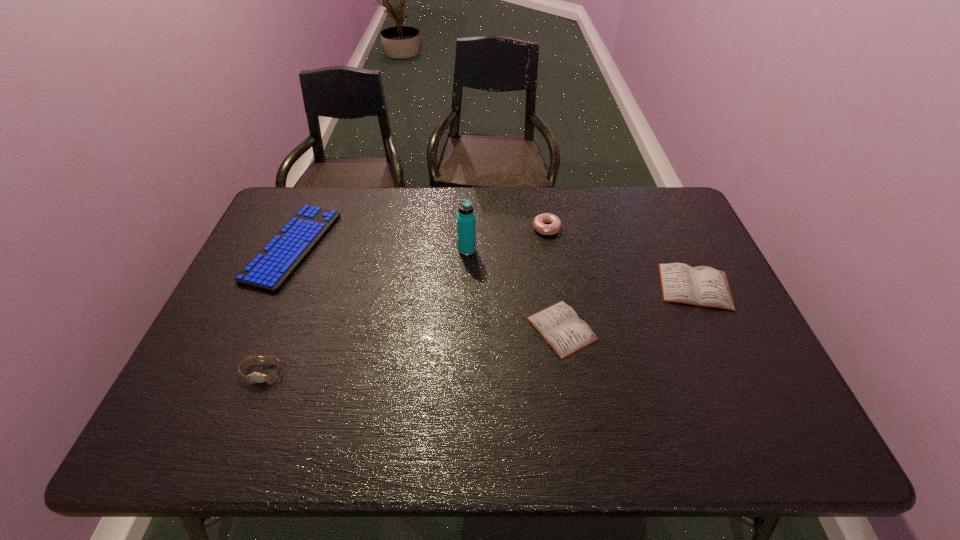
This screenshot has height=540, width=960. In order to click on free spot between the right diary and the shortest object in this screenshot , I will do `click(629, 308)`.

What are the coordinates of `vacant region between the doughnut and the fifth tallest object` in the screenshot? It's located at (620, 258).

Identify the location of vacant space that's between the nearest object and the doughnut. [x=404, y=300].

Locate an element on the screen. This screenshot has height=540, width=960. vacant area that lies between the shorter diary and the rightmost object is located at coordinates (629, 308).

The height and width of the screenshot is (540, 960). What are the coordinates of `vacant space in between the water bottle and the rightmost object` in the screenshot? It's located at (581, 268).

You are a GUI agent. You are given a task and a screenshot of the screen. Output one action in this format:
    pyautogui.click(x=<x>, y=<y>)
    Task: Click on the free space that is in between the shortest object and the computer keyboard
    
    Given the screenshot: What is the action you would take?
    pyautogui.click(x=427, y=288)

This screenshot has width=960, height=540. I want to click on empty location between the water bottle and the shortest object, so click(x=515, y=289).

This screenshot has height=540, width=960. What are the coordinates of `free area in between the left diary and the watch` in the screenshot? It's located at (412, 350).

Where is `empty space that is in between the tallest object and the doughnut`? Image resolution: width=960 pixels, height=540 pixels. empty space that is in between the tallest object and the doughnut is located at coordinates (507, 239).

Find the location of a particular element. Image resolution: width=960 pixels, height=540 pixels. object that is the fifth closest one to the computer keyboard is located at coordinates (703, 286).